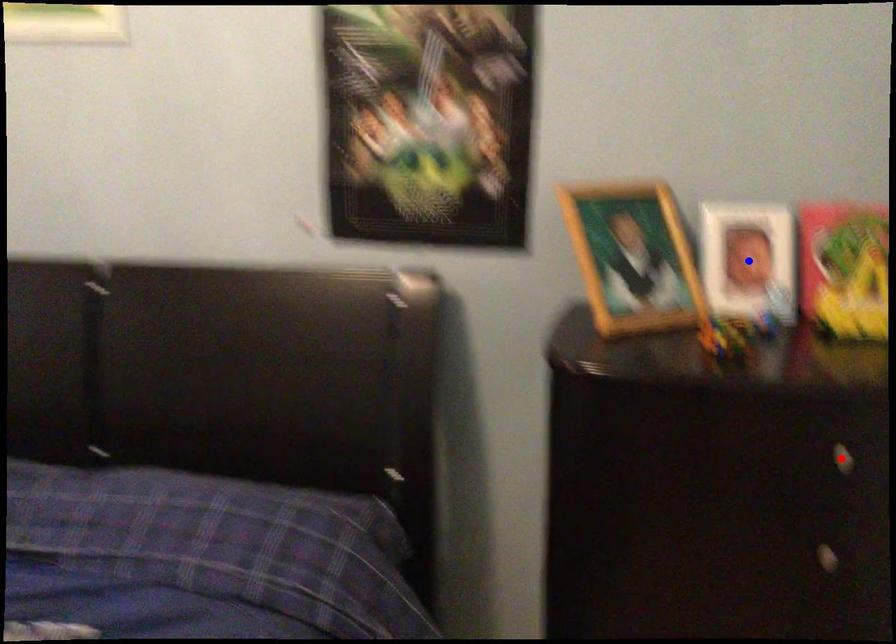
Question: Two points are marked on the image. Which point is closer to the camera?

Choices:
 (A) Blue point is closer.
 (B) Red point is closer.

Answer: (B)